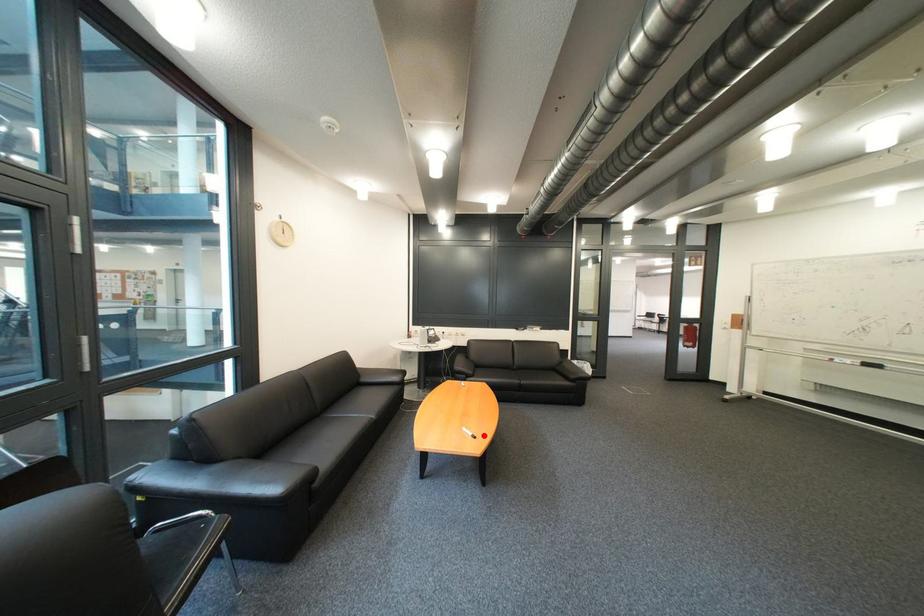
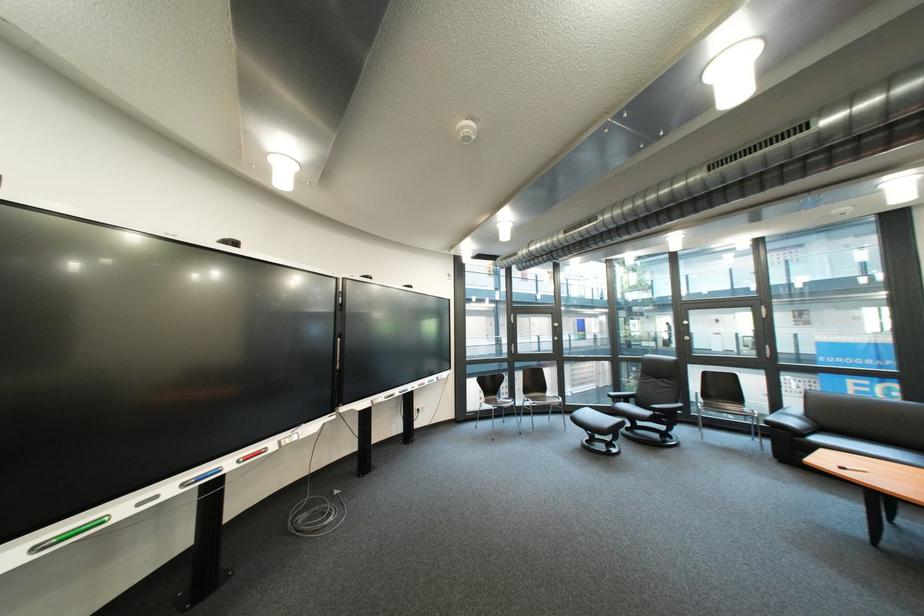
Question: I am providing you with two images of the same scene from different viewpoints. A red point is marked on the first image. Is the red point's position out of view in image 2?

Choices:
 (A) Yes
 (B) No

Answer: (B)